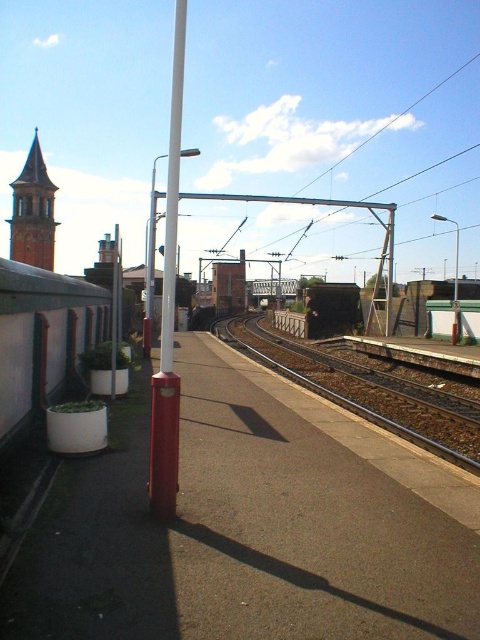
You are a maintenance worker needing to walk from the white concrete platform at lower left to the brown gravel train track at center. Considering their widths, which path would be narrower for you to walk on?

The white concrete platform at lower left has a lesser width compared to the brown gravel train track at center, so the path on the white concrete platform at lower left would be narrower for you to walk on.

You are a passenger waiting on the white concrete platform at lower left and need to board the train that is approaching on the brown gravel train track at center. Which direction should you move to reach the train?

The white concrete platform at lower left is to the right of the brown gravel train track at center, so you should move to the left to reach the train.